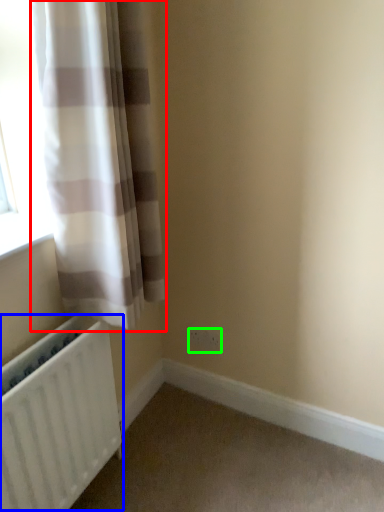
Question: Considering the real-world distances, which object is closest to curtain (highlighted by a red box)? radiator (highlighted by a blue box) or electric outlet (highlighted by a green box).

Choices:
 (A) radiator
 (B) electric outlet

Answer: (A)